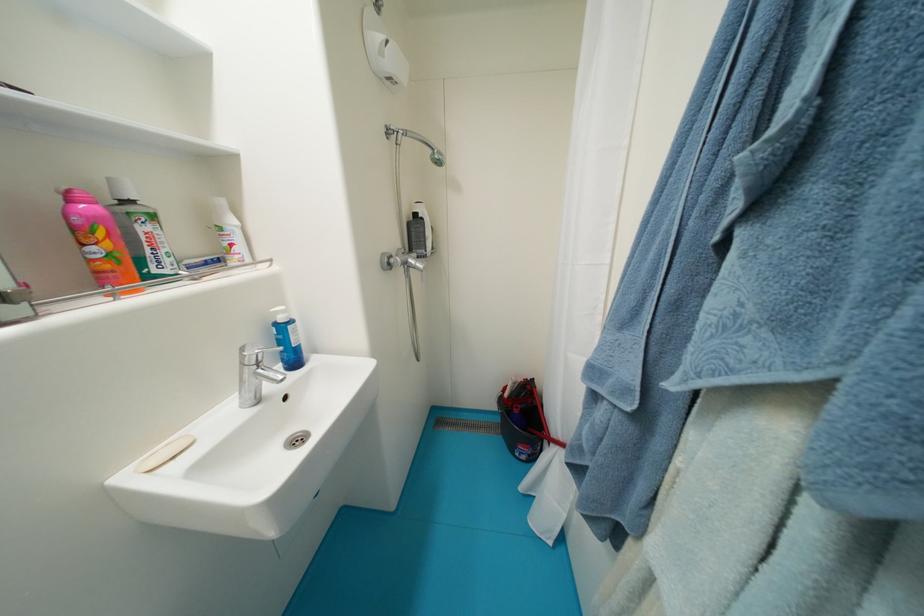
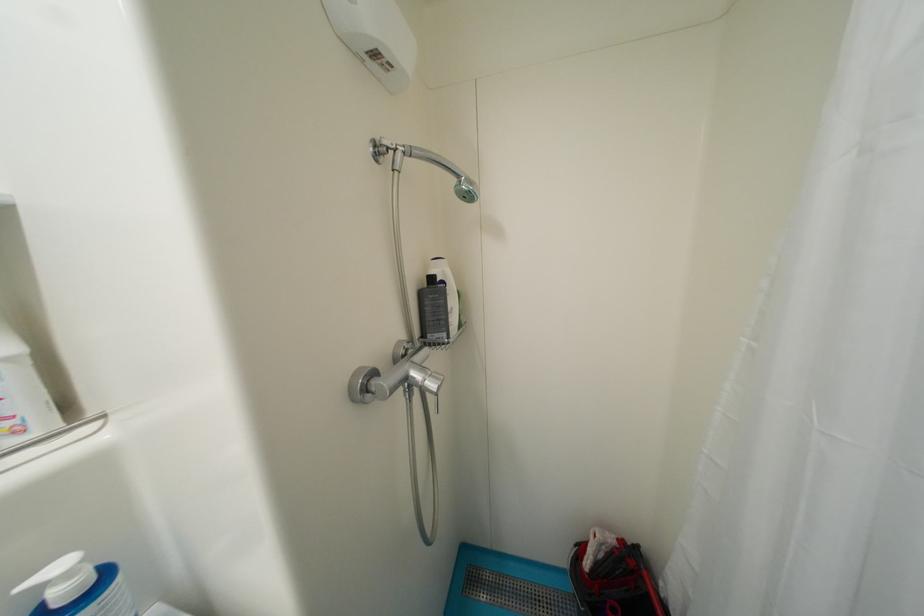
The point at [445,164] is marked in the first image. Where is the corresponding point in the second image?

(476, 199)